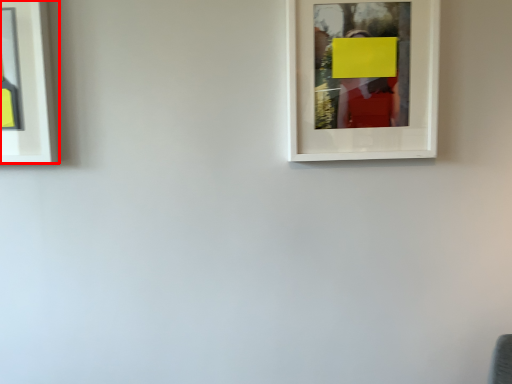
Question: In this image, where is picture frame (annotated by the red box) located relative to picture frame?

Choices:
 (A) right
 (B) left

Answer: (B)